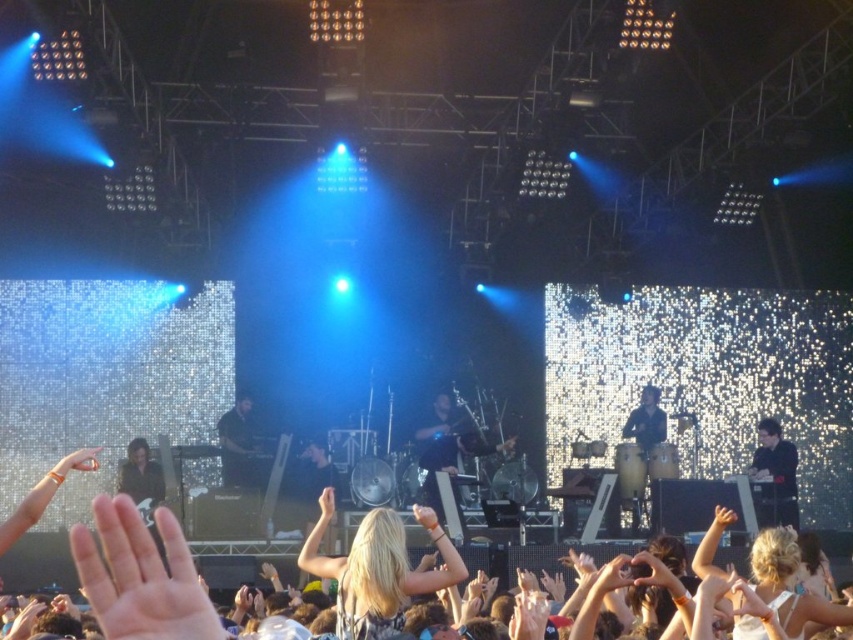
Can you confirm if matte skin hand at center is smaller than smooth skin hand at center?

Correct, matte skin hand at center occupies less space than smooth skin hand at center.

Between matte skin hand at center and smooth skin hand at center, which one appears on the left side from the viewer's perspective?

Positioned to the left is smooth skin hand at center.

Find the location of `matte skin hand at center`. matte skin hand at center is located at coordinates (651, 572).

You are a GUI agent. You are given a task and a screenshot of the screen. Output one action in this format:
    pyautogui.click(x=<x>, y=<y>)
    Task: Click on the matte skin hand at center
    This screenshot has height=640, width=853.
    Given the screenshot: What is the action you would take?
    pyautogui.click(x=651, y=572)

Is point (65, 460) less distant than point (428, 529)?

No.

Does matte skin hand at lower left have a lesser width compared to light brown leather hand at center?

No.

Describe the element at coordinates (78, 460) in the screenshot. The width and height of the screenshot is (853, 640). I see `matte skin hand at lower left` at that location.

Where is `matte skin hand at lower left`? matte skin hand at lower left is located at coordinates (78, 460).

Who is positioned more to the right, blonde hair at center or matte skin hand at center?

From the viewer's perspective, matte skin hand at center appears more on the right side.

Can you confirm if blonde hair at center is positioned to the right of matte skin hand at center?

Incorrect, blonde hair at center is not on the right side of matte skin hand at center.

Which is in front, point (338, 579) or point (637, 580)?

Point (637, 580) is in front.

Find the location of a particular element. This screenshot has width=853, height=640. blonde hair at center is located at coordinates (376, 573).